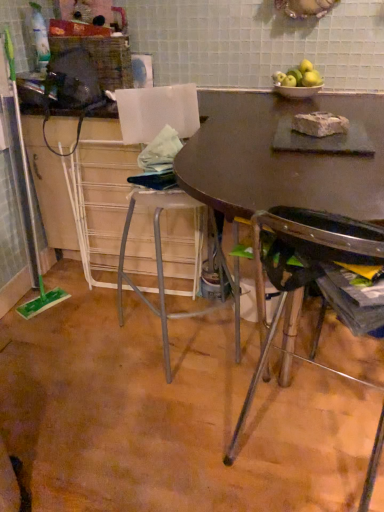
This screenshot has width=384, height=512. I want to click on vacant area on top of matte brown table at center (from a real-world perspective), so click(x=269, y=153).